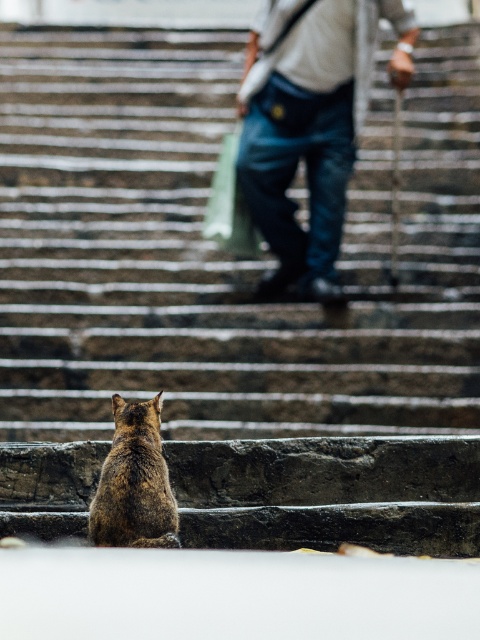
Does denim jeans at upper center have a smaller size compared to brown fur cat at lower left?

Incorrect, denim jeans at upper center is not smaller in size than brown fur cat at lower left.

Where is `denim jeans at upper center`? The height and width of the screenshot is (640, 480). denim jeans at upper center is located at coordinates (307, 125).

Image resolution: width=480 pixels, height=640 pixels. I want to click on denim jeans at upper center, so tap(307, 125).